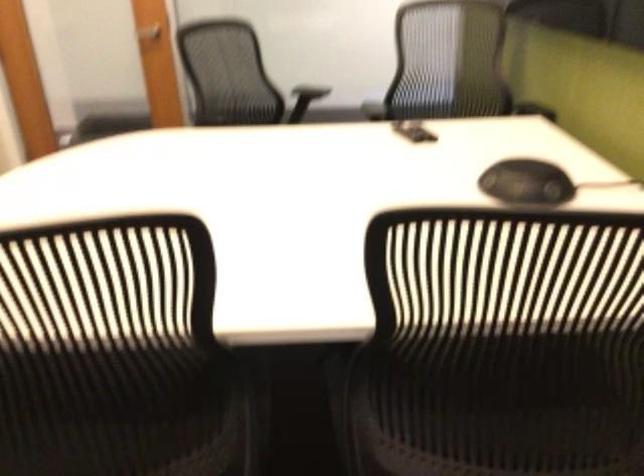
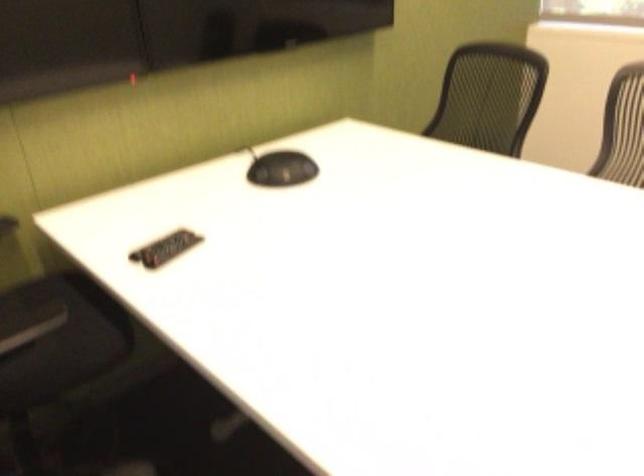
The point at (409, 131) is marked in the first image. Where is the corresponding point in the second image?

(165, 248)